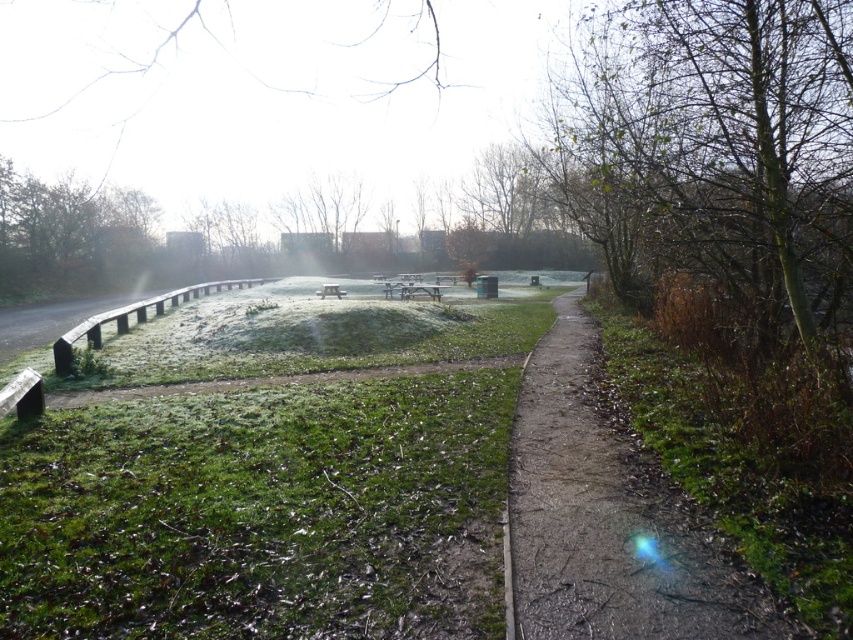
Is point (630, 564) more distant than point (108, 275)?

No, it is not.

Does point (579, 328) come farther from viewer compared to point (112, 284)?

No, it is in front of (112, 284).

Identify the location of dull brown dirt path at right. (607, 518).

Does bare branches at right lie behind dull brown dirt path at right?

Yes.

Is point (833, 284) behind point (700, 557)?

Yes, it is.

Find the location of a particular element. bare branches at right is located at coordinates (717, 152).

Does bare branches at right have a smaller size compared to wooden picnic table at center?

Incorrect, bare branches at right is not smaller in size than wooden picnic table at center.

Can you confirm if bare branches at right is taller than wooden picnic table at center?

Correct, bare branches at right is much taller as wooden picnic table at center.

Which is behind, point (807, 92) or point (335, 296)?

The point (335, 296) is behind.

Where is `bare branches at right`? This screenshot has width=853, height=640. bare branches at right is located at coordinates (717, 152).